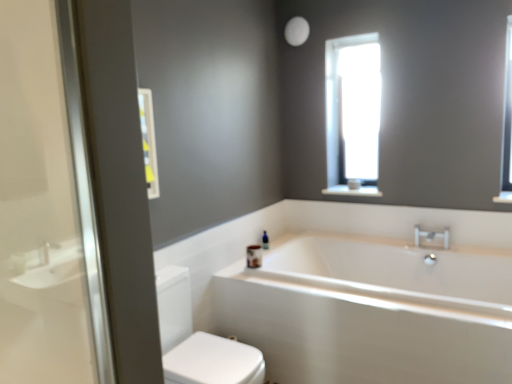
Question: Is white glossy bathtub at center taller or shorter than silver metallic faucet at upper right?

Choices:
 (A) short
 (B) tall

Answer: (B)

Question: From a real-world perspective, is white glossy bathtub at center physically located above or below silver metallic faucet at upper right?

Choices:
 (A) above
 (B) below

Answer: (B)

Question: Estimate the real-world distances between objects in this image. Which object is farther from the blue glass bottle at upper center?

Choices:
 (A) white glossy toilet at lower left
 (B) white glossy bathtub at center
 (C) white glossy medicine cabinet at upper left
 (D) silver metallic faucet at upper right

Answer: (C)

Question: Estimate the real-world distances between objects in this image. Which object is closer to the blue glass bottle at upper center?

Choices:
 (A) white glossy bathtub at center
 (B) white glossy medicine cabinet at upper left
 (C) silver metallic faucet at upper right
 (D) white glossy toilet at lower left

Answer: (A)